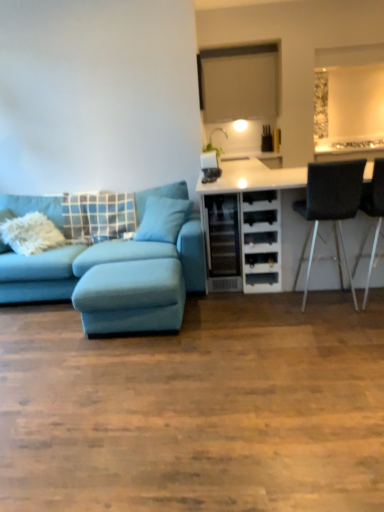
Question: Is black leather chair at right, which is the 1th chair in left-to-right order, positioned far away from teal fabric pillow at center, the 1th pillow when ordered from right to left?

Choices:
 (A) no
 (B) yes

Answer: (B)

Question: Could you tell me if black leather chair at right, which is the 2th chair in right-to-left order, is turned towards teal fabric pillow at center, the 1th pillow when ordered from right to left?

Choices:
 (A) yes
 (B) no

Answer: (B)

Question: Is black leather chair at right, which is the 1th chair in left-to-right order, bigger than teal fabric pillow at center, the 1th pillow when ordered from right to left?

Choices:
 (A) no
 (B) yes

Answer: (B)

Question: From a real-world perspective, is black leather chair at right, which is the 2th chair in right-to-left order, over teal fabric pillow at center, the 1th pillow when ordered from right to left?

Choices:
 (A) no
 (B) yes

Answer: (A)

Question: Is black leather chair at right, which is the 2th chair in right-to-left order, turned away from teal fabric pillow at center, the 1th pillow when ordered from right to left?

Choices:
 (A) no
 (B) yes

Answer: (A)

Question: Is black leather chair at right, which is the 2th chair in right-to-left order, with teal fabric pillow at center, the 1th pillow when ordered from right to left?

Choices:
 (A) yes
 (B) no

Answer: (B)

Question: From a real-world perspective, is blue fabric pillow at left, acting as the first pillow starting from the left, below light blue fabric footrest at lower left?

Choices:
 (A) yes
 (B) no

Answer: (B)

Question: Does blue fabric pillow at left, acting as the first pillow starting from the left, have a greater width compared to light blue fabric footrest at lower left?

Choices:
 (A) yes
 (B) no

Answer: (B)

Question: Is blue fabric pillow at left, which is the second pillow from right to left, oriented towards light blue fabric footrest at lower left?

Choices:
 (A) yes
 (B) no

Answer: (A)

Question: Does blue fabric pillow at left, which is the second pillow from right to left, have a greater height compared to light blue fabric footrest at lower left?

Choices:
 (A) no
 (B) yes

Answer: (B)

Question: Is blue fabric pillow at left, acting as the first pillow starting from the left, looking in the opposite direction of light blue fabric footrest at lower left?

Choices:
 (A) no
 (B) yes

Answer: (A)

Question: From the image's perspective, is blue fabric pillow at left, which is the second pillow from right to left, above light blue fabric footrest at lower left?

Choices:
 (A) yes
 (B) no

Answer: (A)

Question: Would you consider blue fabric pillow at left, acting as the first pillow starting from the left, to be distant from black leather chair at right, which is the 1th chair in left-to-right order?

Choices:
 (A) yes
 (B) no

Answer: (A)